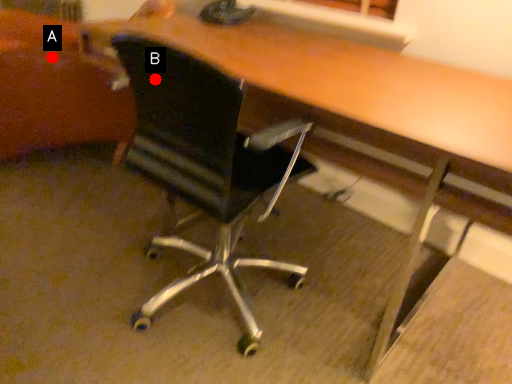
Question: Two points are circled on the image, labeled by A and B beside each circle. Among these points, which one is nearest to the camera?

Choices:
 (A) A is closer
 (B) B is closer

Answer: (B)